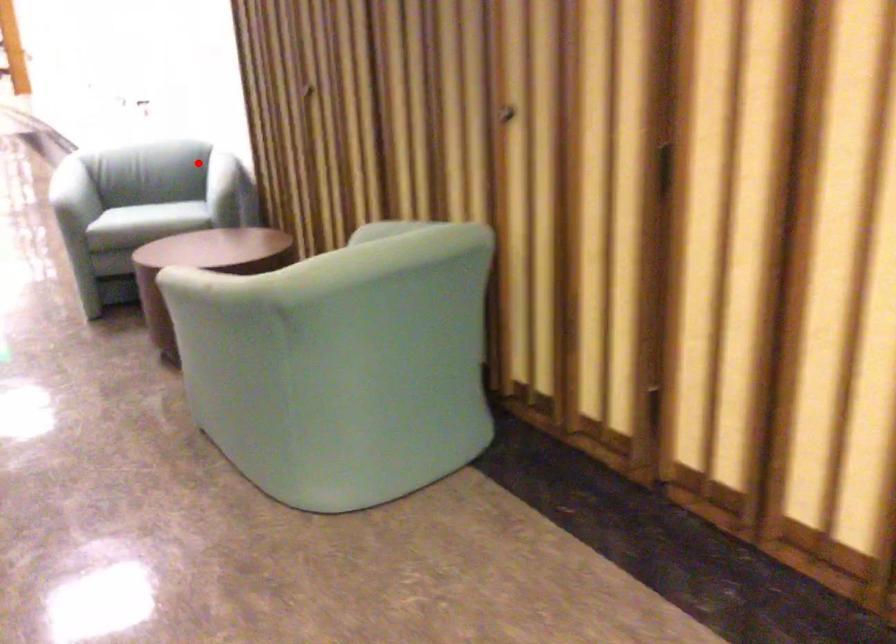
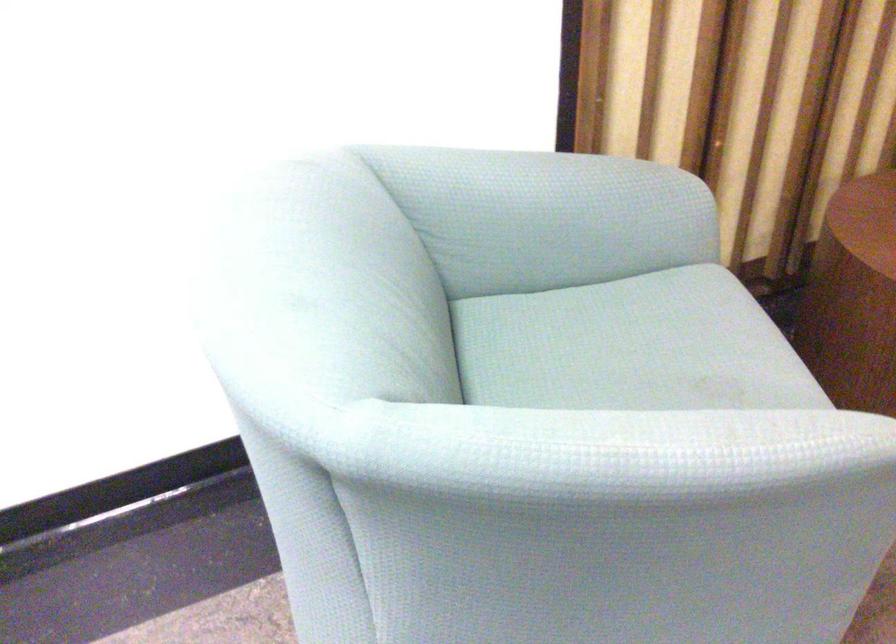
Question: I am providing you with two images of the same scene from different viewpoints. Image1 has a red point marked. In image2, the corresponding 3D location appears at what relative position? Reply with the corresponding letter.

Choices:
 (A) Closer
 (B) Farther

Answer: (A)